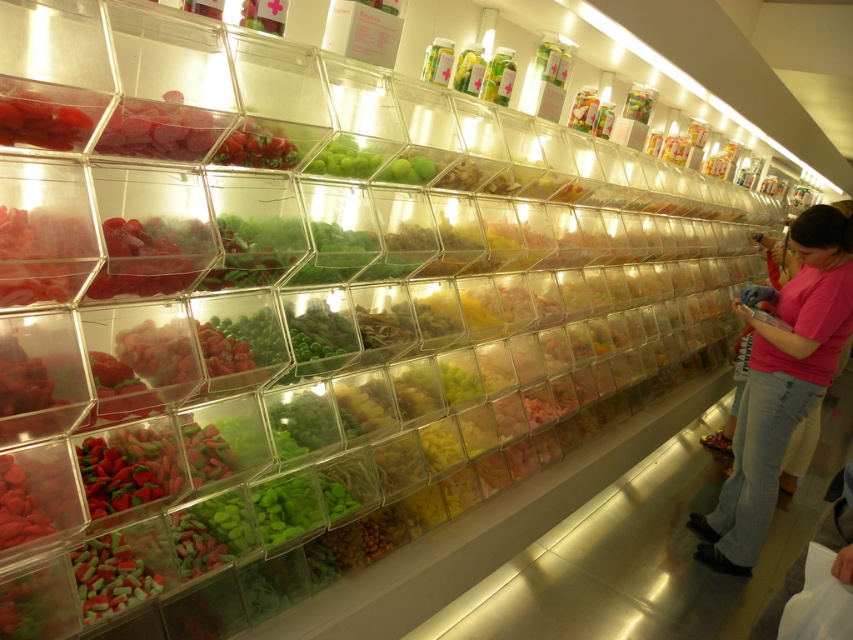
Is pink fabric shirt at right positioned behind matte red candy at left?

Yes, it is.

Can you confirm if pink fabric shirt at right is bigger than matte red candy at left?

Yes.

Is point (809, 224) farther from viewer compared to point (74, 285)?

Yes, it is.

I want to click on pink fabric shirt at right, so click(x=781, y=384).

Is the position of pink fabric shirt at right less distant than that of matte red candy at upper left?

No, it is behind matte red candy at upper left.

The height and width of the screenshot is (640, 853). I want to click on pink fabric shirt at right, so click(781, 384).

Between point (746, 497) and point (122, 152), which one is positioned behind?

Point (746, 497)

You are a GUI agent. You are given a task and a screenshot of the screen. Output one action in this format:
    pyautogui.click(x=<x>, y=<y>)
    Task: Click on the pink fabric shirt at right
    
    Given the screenshot: What is the action you would take?
    pyautogui.click(x=781, y=384)

Between matte red candy at left and matte red candy at upper left, which one is positioned lower?

matte red candy at left is lower down.

Which is behind, point (6, 248) or point (165, 148)?

Positioned behind is point (165, 148).

Which is behind, point (44, 291) or point (125, 112)?

Positioned behind is point (125, 112).

This screenshot has width=853, height=640. Identify the location of matte red candy at left. [x=42, y=256].